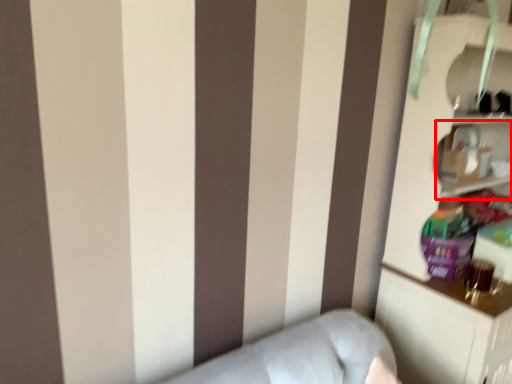
Question: From the image's perspective, where is cabinet (annotated by the red box) located relative to bookcase?

Choices:
 (A) below
 (B) above

Answer: (B)